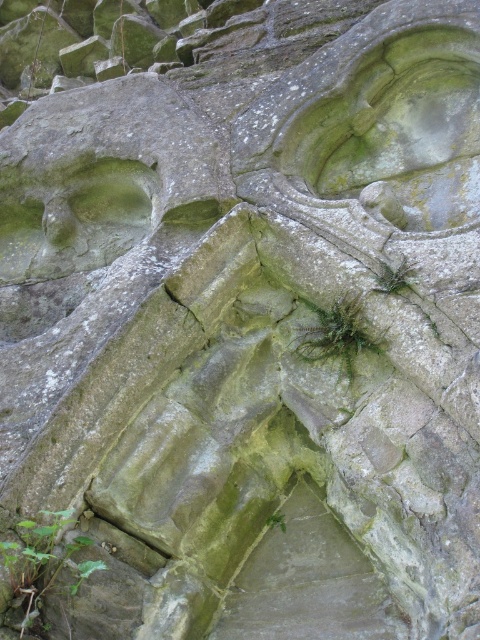
You are examining the ancient stone structure and notice two points marked on it. The first point is at coordinates point (23, 540) and the second is at point (373, 348). Which of these two points is nearer to your viewpoint?

Point (23, 540) is closer to the viewer than point (373, 348).